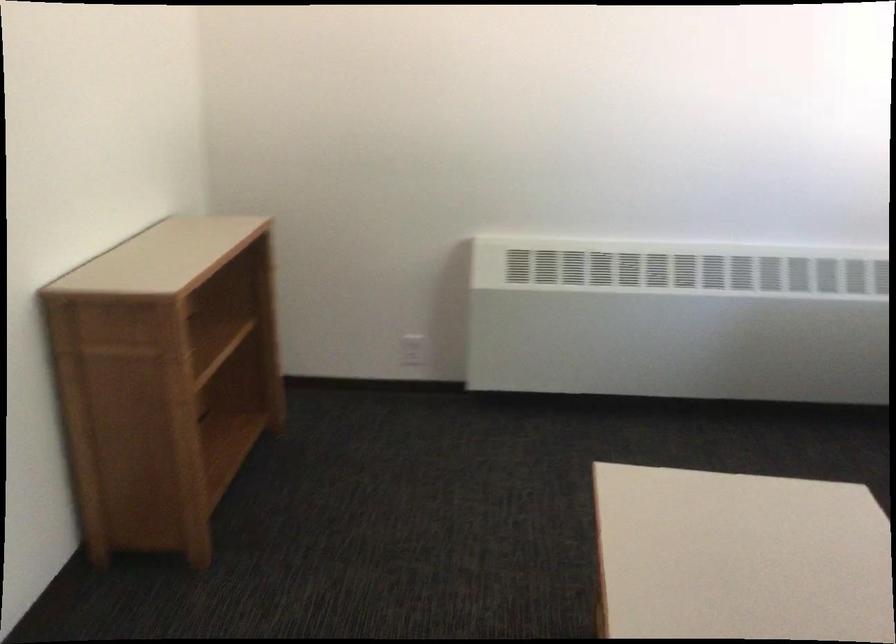
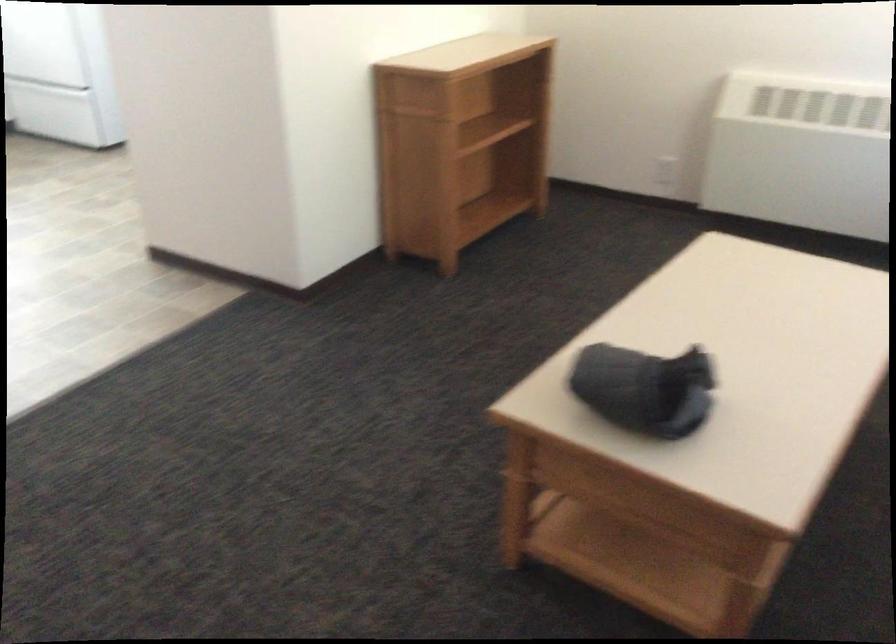
In a continuous first-person perspective shot, in which direction is the camera moving?

The movement direction of the cameraman is right, backward.